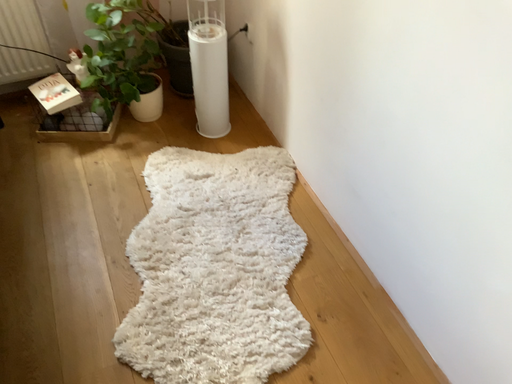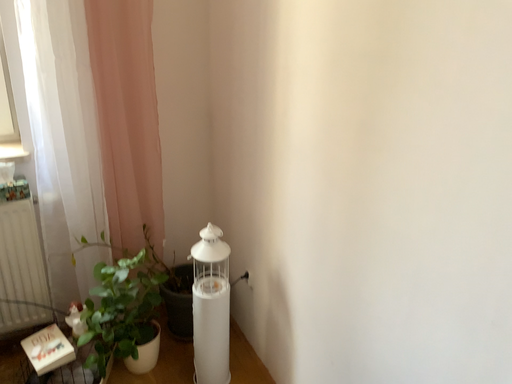
Question: Which way did the camera rotate in the video?

Choices:
 (A) rotated downward
 (B) rotated upward

Answer: (B)